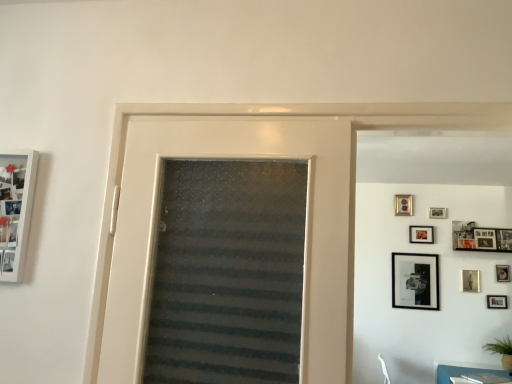
The image size is (512, 384). Describe the element at coordinates (15, 210) in the screenshot. I see `white glossy picture frame at left` at that location.

Where is `white glossy picture frame at left`? This screenshot has height=384, width=512. white glossy picture frame at left is located at coordinates (15, 210).

The image size is (512, 384). What are the coordinates of `white glossy picture frame at left` in the screenshot? It's located at (15, 210).